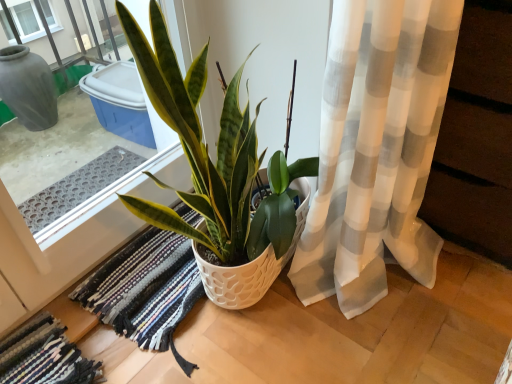
Question: Is the surface of green glossy plant at center in direct contact with multicolored woven rug at center, the 1th bath mat from the right?

Choices:
 (A) yes
 (B) no

Answer: (B)

Question: Is green glossy plant at center smaller than multicolored woven rug at center, the 1th bath mat from the right?

Choices:
 (A) yes
 (B) no

Answer: (B)

Question: Can you confirm if green glossy plant at center is positioned to the left of multicolored woven rug at center, the second bath mat from the left?

Choices:
 (A) no
 (B) yes

Answer: (A)

Question: Does green glossy plant at center lie in front of multicolored woven rug at center, the second bath mat from the left?

Choices:
 (A) yes
 (B) no

Answer: (A)

Question: From the image's perspective, is green glossy plant at center on multicolored woven rug at center, the 1th bath mat from the right?

Choices:
 (A) no
 (B) yes

Answer: (B)

Question: Considering the relative sizes of green glossy plant at center and multicolored woven rug at center, the second bath mat from the left, in the image provided, is green glossy plant at center thinner than multicolored woven rug at center, the second bath mat from the left,?

Choices:
 (A) no
 (B) yes

Answer: (B)

Question: Is multicolored woven rug at lower left, which is the second bath mat in right-to-left order, looking in the opposite direction of green glossy plant at center?

Choices:
 (A) no
 (B) yes

Answer: (A)

Question: Is multicolored woven rug at lower left, which ranks as the 1th bath mat in left-to-right order, located outside green glossy plant at center?

Choices:
 (A) yes
 (B) no

Answer: (A)

Question: Could you tell me if multicolored woven rug at lower left, which ranks as the 1th bath mat in left-to-right order, is turned towards green glossy plant at center?

Choices:
 (A) no
 (B) yes

Answer: (A)

Question: Is multicolored woven rug at lower left, which is the second bath mat in right-to-left order, surrounding green glossy plant at center?

Choices:
 (A) yes
 (B) no

Answer: (B)

Question: Is multicolored woven rug at lower left, which is the second bath mat in right-to-left order, wider than green glossy plant at center?

Choices:
 (A) no
 (B) yes

Answer: (A)

Question: Considering the relative sizes of multicolored woven rug at lower left, which ranks as the 1th bath mat in left-to-right order, and green glossy plant at center in the image provided, is multicolored woven rug at lower left, which ranks as the 1th bath mat in left-to-right order, shorter than green glossy plant at center?

Choices:
 (A) no
 (B) yes

Answer: (B)

Question: Is green glossy plant at center outside of multicolored woven rug at lower left, which is the second bath mat in right-to-left order?

Choices:
 (A) no
 (B) yes

Answer: (B)